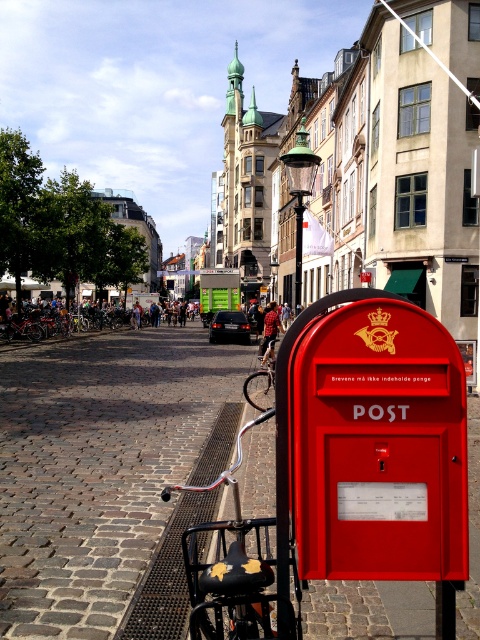
Question: Estimate the real-world distances between objects in this image. Which object is farther from the cobblestone pavement at lower left?

Choices:
 (A) red matte postbox at lower right
 (B) black matte bicycle at lower left

Answer: (A)

Question: Can you confirm if red matte postbox at lower right is positioned below black matte bicycle at lower left?

Choices:
 (A) no
 (B) yes

Answer: (A)

Question: Does red matte postbox at lower right appear under black matte bicycle at lower left?

Choices:
 (A) no
 (B) yes

Answer: (A)

Question: Which point appears farthest from the camera in this image?

Choices:
 (A) (182, 547)
 (B) (33, 608)

Answer: (B)

Question: Which object is closer to the camera taking this photo?

Choices:
 (A) cobblestone pavement at lower left
 (B) red matte postbox at lower right

Answer: (B)

Question: Can you confirm if red matte postbox at lower right is positioned to the right of black matte bicycle at lower left?

Choices:
 (A) no
 (B) yes

Answer: (B)